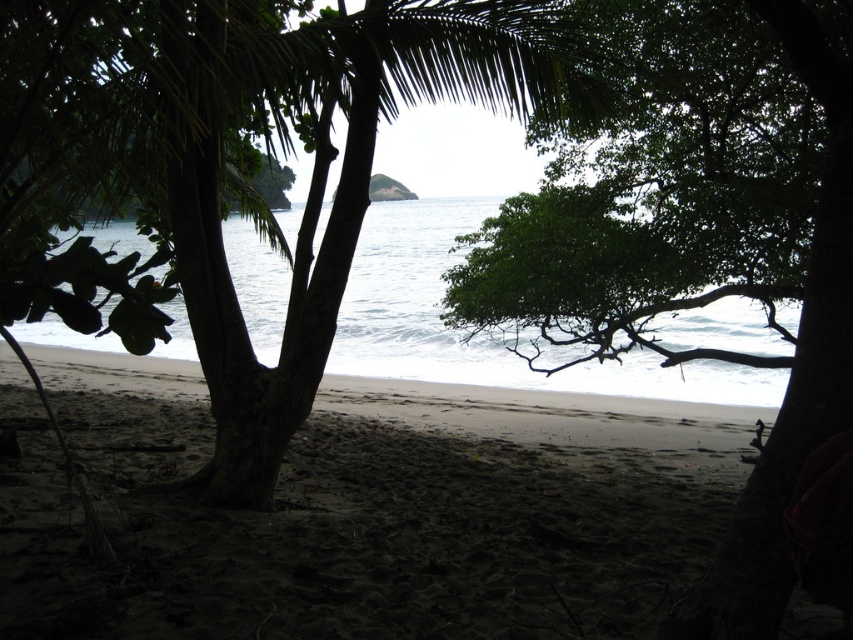
You are a drone operator who needs to fly a drone between the green leafy tree at center and the white smooth water at center. The drone has a maximum flight distance of 20 feet. Can the drone safely fly between them without exceeding its limit?

The green leafy tree at center and white smooth water at center are 18.98 feet apart from each other. Since the distance is less than the drone maximum flight distance of 20 feet, the drone can safely fly between them without exceeding its limit.

You are standing on the beach and want to take a photo of both the green leafy palm tree at center and the white smooth water at center. Which object should you zoom in on to ensure both fit in the frame?

The green leafy palm tree at center is smaller than the white smooth water at center, so you should zoom in on the white smooth water at center to ensure both fit in the frame.

You are standing on the beach and see both the green leafy palm tree at center and the green leafy tree at center. Which tree appears closer to the water?

The green leafy palm tree at center is located below the green leafy tree at center, so it appears closer to the water.